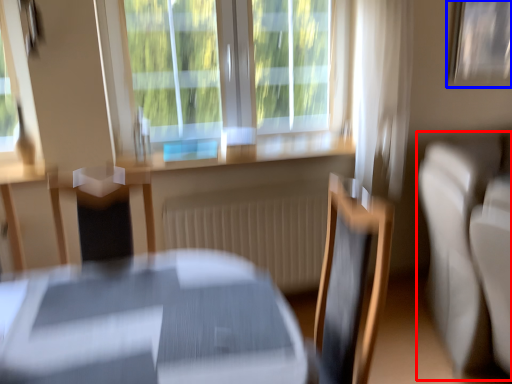
Question: Which of the following is the farthest to the observer, couch (highlighted by a red box) or picture frame (highlighted by a blue box)?

Choices:
 (A) couch
 (B) picture frame

Answer: (B)